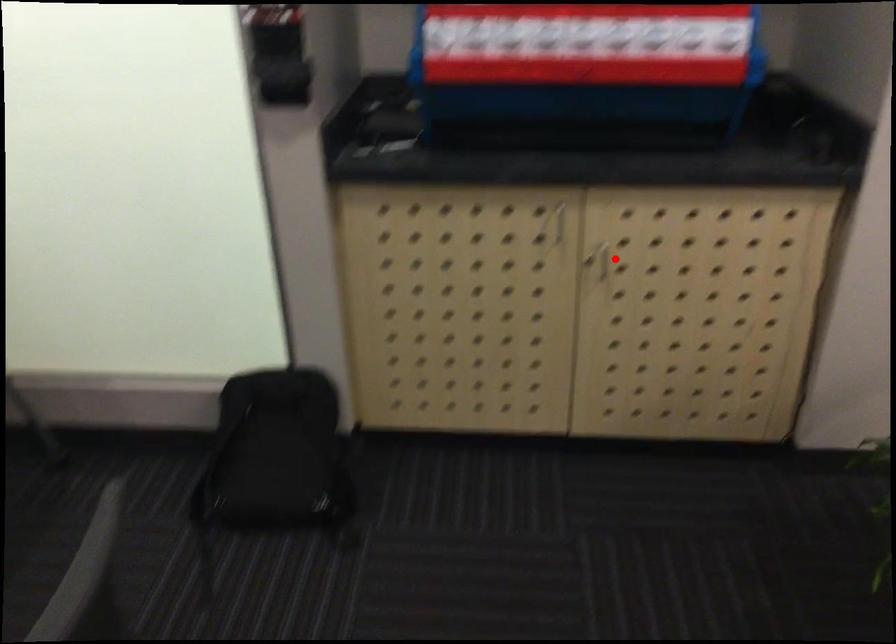
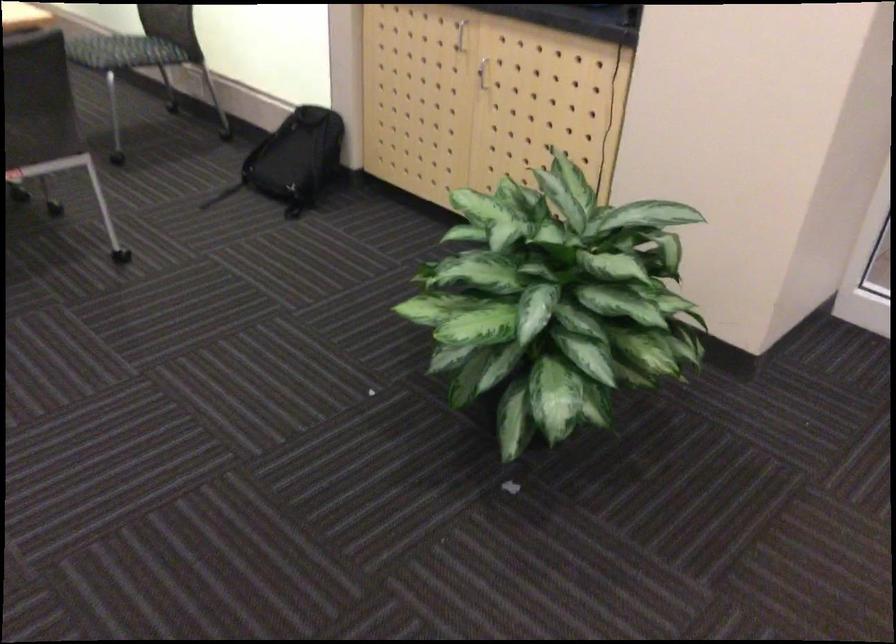
The point at the highlighted location is marked in the first image. Where is the corresponding point in the second image?

(483, 73)